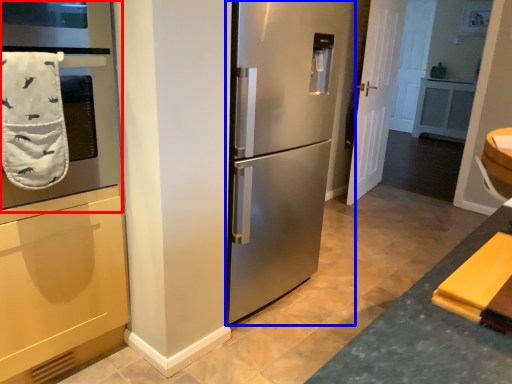
Question: Which point is further to the camera, oven (highlighted by a red box) or refrigerator (highlighted by a blue box)?

Choices:
 (A) oven
 (B) refrigerator

Answer: (B)